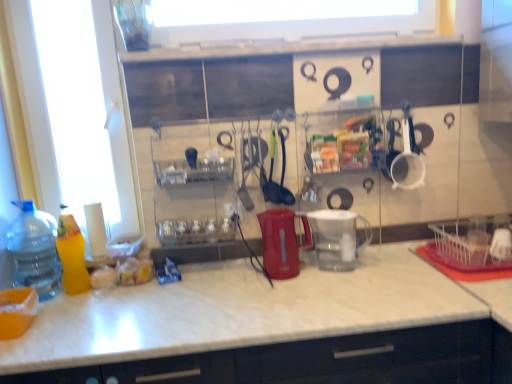
I want to click on empty space that is to the right of yellow plastic bottle at left, positioned as the 2th bottle in left-to-right order, so click(x=116, y=296).